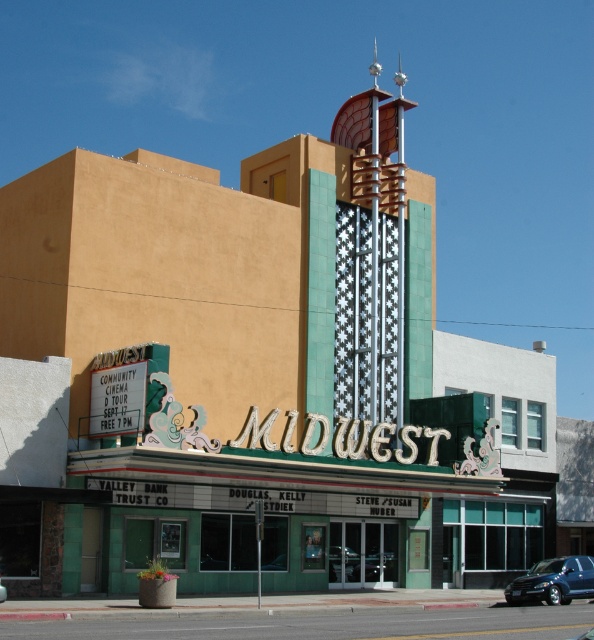
Which is more to the right, metallic blue suv at center or metallic blue car at center?

metallic blue suv at center is more to the right.

Who is taller, metallic blue suv at center or metallic blue car at center?

With more height is metallic blue suv at center.

Does point (580, 564) lie in front of point (1, 589)?

That is False.

Where is `metallic blue suv at center`? This screenshot has width=594, height=640. metallic blue suv at center is located at coordinates (554, 580).